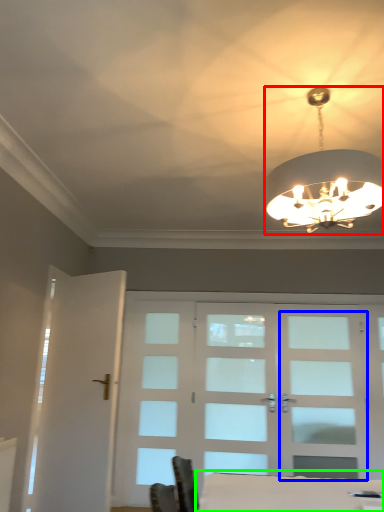
Question: Considering the real-world distances, which object is farthest from lamp (highlighted by a red box)? screen door (highlighted by a blue box) or table (highlighted by a green box)?

Choices:
 (A) screen door
 (B) table

Answer: (A)